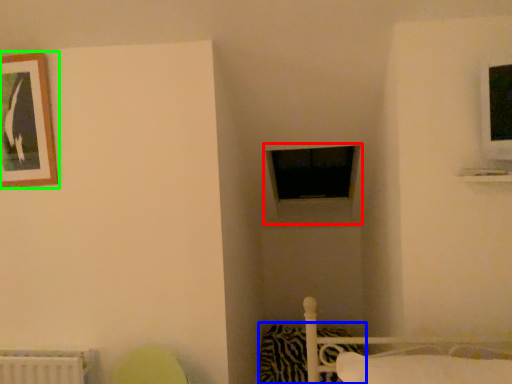
Question: Which object is the closest to the window frame (highlighted by a red box)? Choose among these: pillow (highlighted by a blue box) or picture frame (highlighted by a green box).

Choices:
 (A) pillow
 (B) picture frame

Answer: (A)